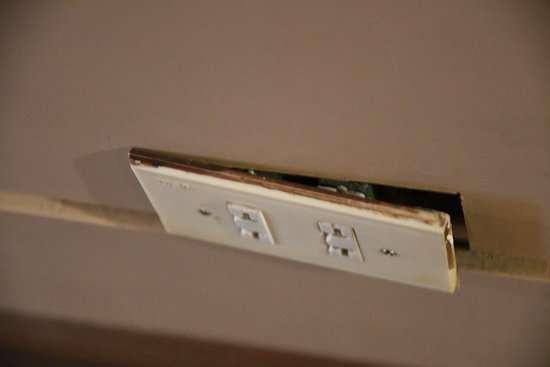
I want to click on wall above cover, so click(276, 127).